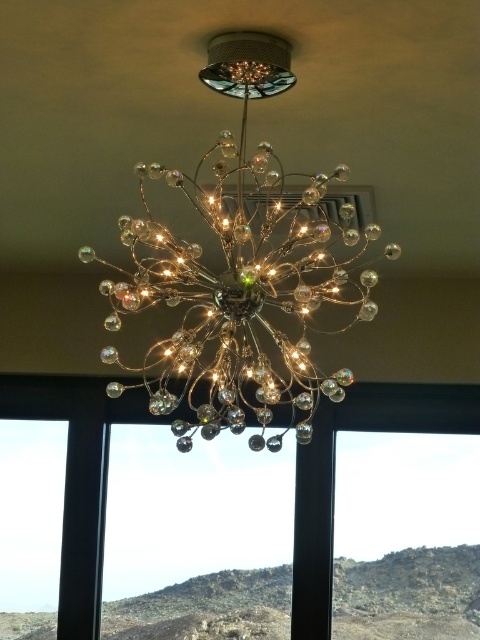
You are standing directly below the metallic crystal chandelier at center. What is the exact coordinate where you are standing?

The exact coordinate where you are standing directly below the metallic crystal chandelier at center is point (240, 269).

You are standing in a room with a metallic crystal chandelier at center and a transparent glass window at center. Which object is closer to the left side of the room?

The metallic crystal chandelier at center is closer to the left side of the room than the transparent glass window at center.

From the picture: You are standing in a room with a metallic crystal chandelier at center and a transparent glass window at center. If you look upward, which object will you see first?

The metallic crystal chandelier at center is positioned over the transparent glass window at center, so when looking upward, you will see the metallic crystal chandelier at center first.